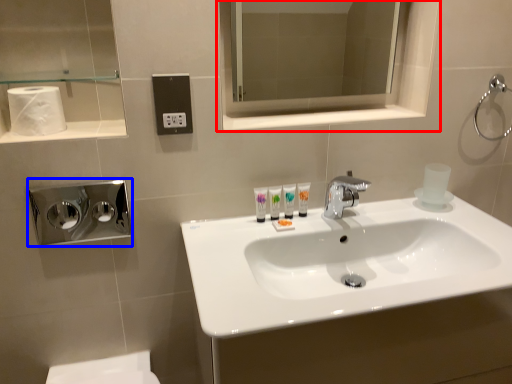
Question: Among these objects, which one is nearest to the camera, medicine cabinet (highlighted by a red box) or hand dryer (highlighted by a blue box)?

Choices:
 (A) medicine cabinet
 (B) hand dryer

Answer: (B)